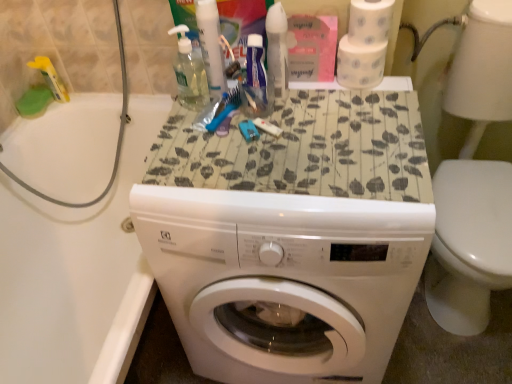
Question: From the image's perspective, relative to translucent plastic spray bottle at upper center, which is the second cleaning product from left to right, is white glossy bathtub at left above or below?

Choices:
 (A) above
 (B) below

Answer: (B)

Question: Is point (137, 139) positioned closer to the camera than point (283, 16)?

Choices:
 (A) farther
 (B) closer

Answer: (A)

Question: Based on their relative distances, which object is nearer to the translucent plastic spray bottle at upper center, marked as the 1th cleaning product in a right-to-left arrangement?

Choices:
 (A) white glossy bathtub at left
 (B) transparent liquid soap at upper center, the second cleaning product in the right-to-left sequence
 (C) white textured toilet paper at upper right, the 2th toilet paper when ordered from bottom to top
 (D) translucent plastic toothpaste tube at upper center, placed as the second toiletry when sorted from left to right
 (E) white glossy washing machine at center

Answer: (D)

Question: Which of these objects is positioned closest to the white textured toilet paper at upper right, the 2th toilet paper when ordered from bottom to top?

Choices:
 (A) translucent plastic spray bottle at upper center, which is the second cleaning product from left to right
 (B) yellow plastic bottle at upper left, which is counted as the 1th toiletry, starting from the left
 (C) white glossy washer at lower right
 (D) white glossy bathtub at left
 (E) transparent liquid soap at upper center, the 1th cleaning product when ordered from left to right

Answer: (A)